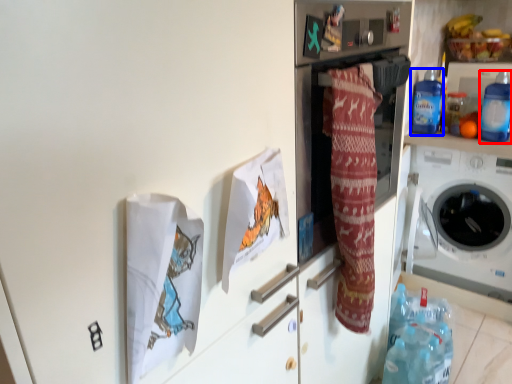
Question: Among these objects, which one is farthest to the camera, bottle (highlighted by a red box) or bottle (highlighted by a blue box)?

Choices:
 (A) bottle
 (B) bottle

Answer: (B)